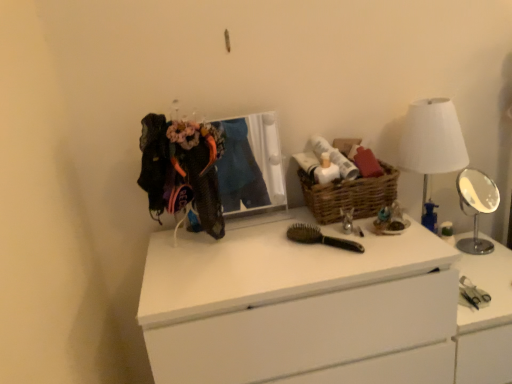
Image resolution: width=512 pixels, height=384 pixels. In order to click on free location in front of black wooden hairbrush at center in this screenshot , I will do point(328,269).